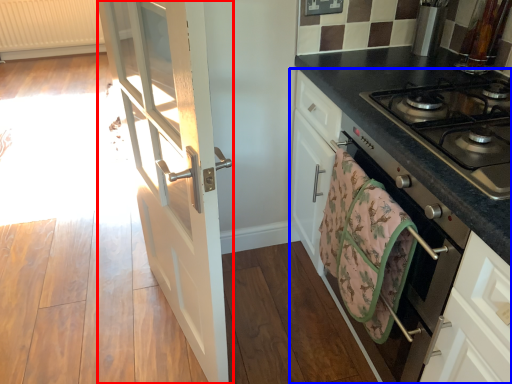
Question: Which object is further to the camera taking this photo, door (highlighted by a red box) or cabinetry (highlighted by a blue box)?

Choices:
 (A) door
 (B) cabinetry

Answer: (A)